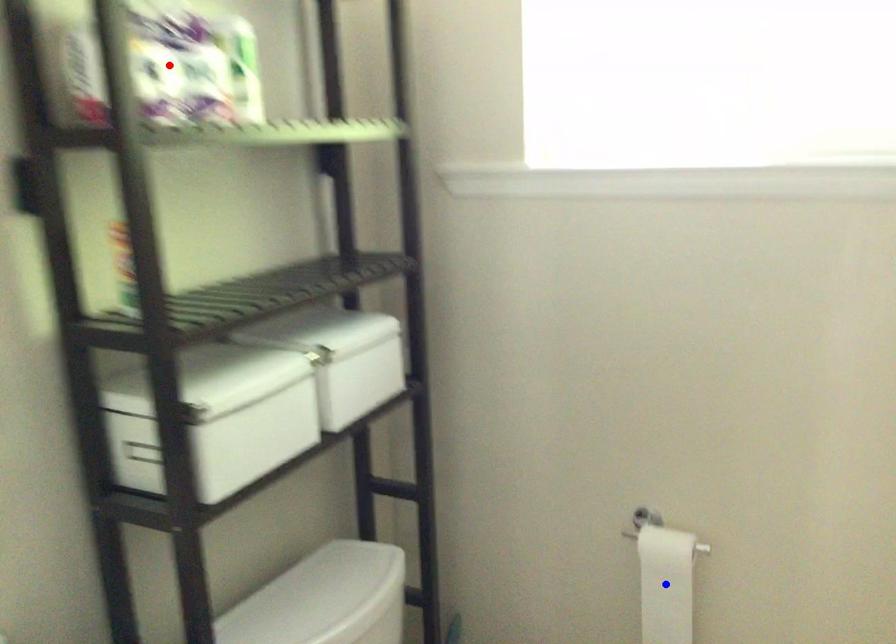
Question: Two points are marked on the image. Which point is closer to the camera?

Choices:
 (A) Blue point is closer.
 (B) Red point is closer.

Answer: (B)